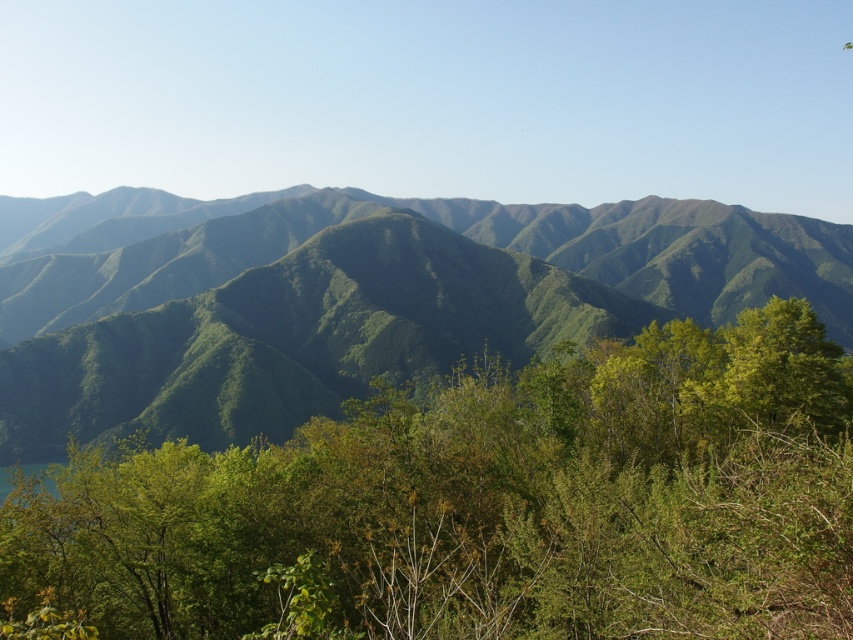
Is point (457, 621) positioned after point (61, 413)?

No, it is not.

Does point (697, 531) come closer to viewer compared to point (241, 280)?

Yes, point (697, 531) is closer to viewer.

Locate an element on the screen. Image resolution: width=853 pixels, height=640 pixels. green leafy tree at center is located at coordinates (480, 506).